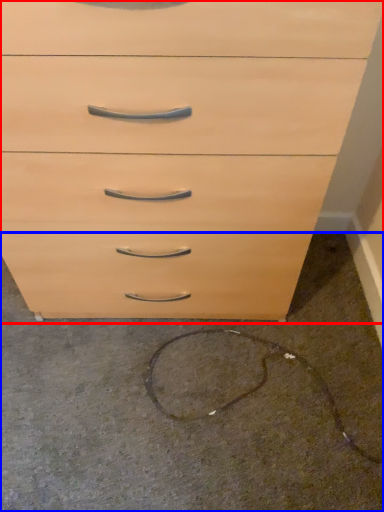
Question: Which object appears farthest to the camera in this image, chest of drawers (highlighted by a red box) or concrete (highlighted by a blue box)?

Choices:
 (A) chest of drawers
 (B) concrete

Answer: (B)